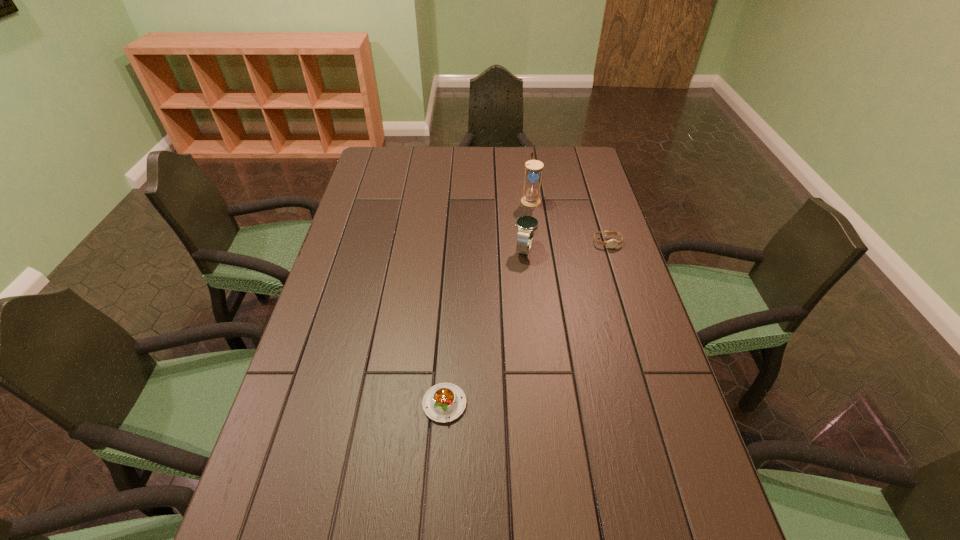
Identify the location of vacant region located on the face of the right watch. This screenshot has width=960, height=540. (621, 287).

Where is `vacant space positioned on the right of the leftmost object`? The image size is (960, 540). vacant space positioned on the right of the leftmost object is located at coordinates (621, 404).

This screenshot has height=540, width=960. I want to click on object at the right edge, so click(612, 243).

I want to click on free point at the far edge, so click(501, 163).

What are the coordinates of `vacant area at the left edge` in the screenshot? It's located at (366, 227).

This screenshot has width=960, height=540. Identify the location of free region at the right edge. (633, 308).

I want to click on free spot at the far left corner of the desktop, so click(387, 148).

Locate an element on the screen. The height and width of the screenshot is (540, 960). blank region between the pudding and the second tallest object is located at coordinates (485, 326).

Image resolution: width=960 pixels, height=540 pixels. Find the location of `vacant space that's between the pudding and the taller watch`. vacant space that's between the pudding and the taller watch is located at coordinates (485, 326).

Where is `free spot between the hourglass and the leftmost object`? The image size is (960, 540). free spot between the hourglass and the leftmost object is located at coordinates (488, 302).